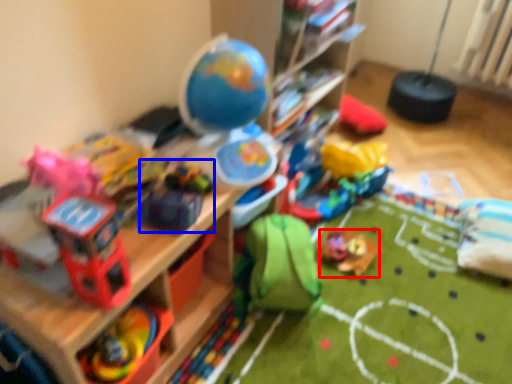
Question: Which point is closer to the camera, toy (highlighted by a red box) or toy (highlighted by a blue box)?

Choices:
 (A) toy
 (B) toy

Answer: (B)